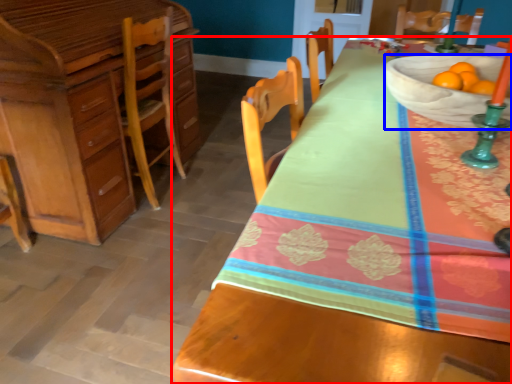
Question: Which object is closer to the camera taking this photo, desk (highlighted by a red box) or bowl (highlighted by a blue box)?

Choices:
 (A) desk
 (B) bowl

Answer: (A)